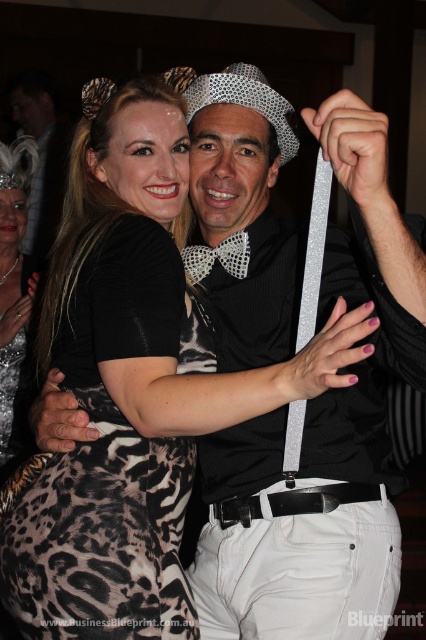
Wait, there are two leopard print dresses at the center? That seems confusing. Let me check the objects again. Oh, the objects are labeled as leopard print fabric dress at center and leopard print dress at center. The description says the first is to the right of the second. Hmm, maybe one is fabric and the other is just dress? The question should ask about their positions without revealing the description. Since the scene mentions a woman in a leopard print skirt and a man in a sparkly hat, perhaps the two

The leopard print fabric dress at center is positioned to the right of the leopard print dress at center, meaning the fabric dress is located to the right side of the other dress in the center area.

You are a photographer at the party and need to decide which object to focus on first for a closeup shot. Since the leopard print dress at center and the matte black bow tie at center are both in the center, which one would you choose if you want to capture the larger object?

The leopard print dress at center is bigger than the matte black bow tie at center, so you should focus on the leopard print dress at center first for the closeup shot.